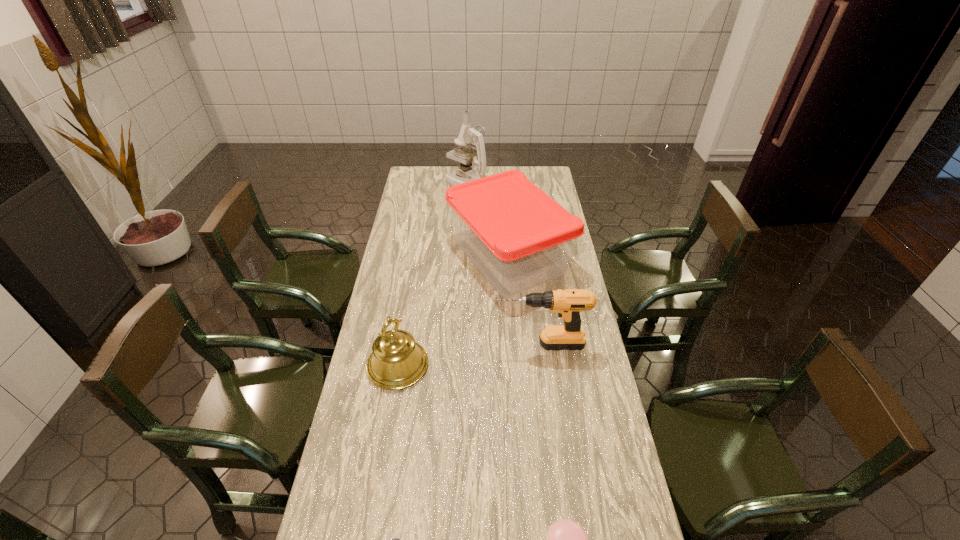
Identify the location of vacant space located on the back of the bell. The image size is (960, 540). pyautogui.click(x=411, y=289).

At what (x,y) coordinates should I click in order to perform the action: click on object that is at the far edge. Please return your answer as a coordinate pair (x, y). The height and width of the screenshot is (540, 960). Looking at the image, I should click on (467, 136).

Identify the location of object located at the left edge. (396, 362).

Locate an element on the screen. The width and height of the screenshot is (960, 540). tray at the right edge is located at coordinates (518, 237).

The width and height of the screenshot is (960, 540). I want to click on drill present at the right edge, so click(x=568, y=303).

Where is `blank space at the left edge of the desktop`? This screenshot has height=540, width=960. blank space at the left edge of the desktop is located at coordinates (422, 213).

This screenshot has width=960, height=540. In the image, there is a desktop. Identify the location of vacant space at the right edge. (590, 355).

Where is `free spot between the tray and the bell`? This screenshot has height=540, width=960. free spot between the tray and the bell is located at coordinates (453, 312).

Identify the location of object that is the closest to the drill. The height and width of the screenshot is (540, 960). (518, 237).

Find the location of a particular element. object that stands as the closest to the tray is located at coordinates (568, 303).